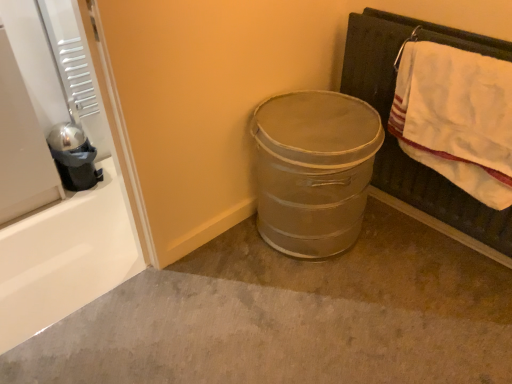
Image resolution: width=512 pixels, height=384 pixels. Identify the location of free space to the left of metallic gray trash can at center. (216, 268).